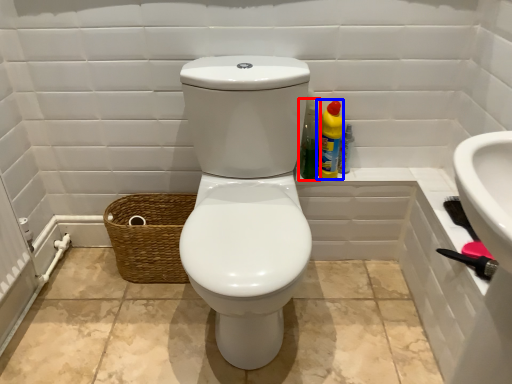
Question: Which object appears farthest to the camera in this image, cleaning product (highlighted by a red box) or cleaning product (highlighted by a blue box)?

Choices:
 (A) cleaning product
 (B) cleaning product

Answer: (B)